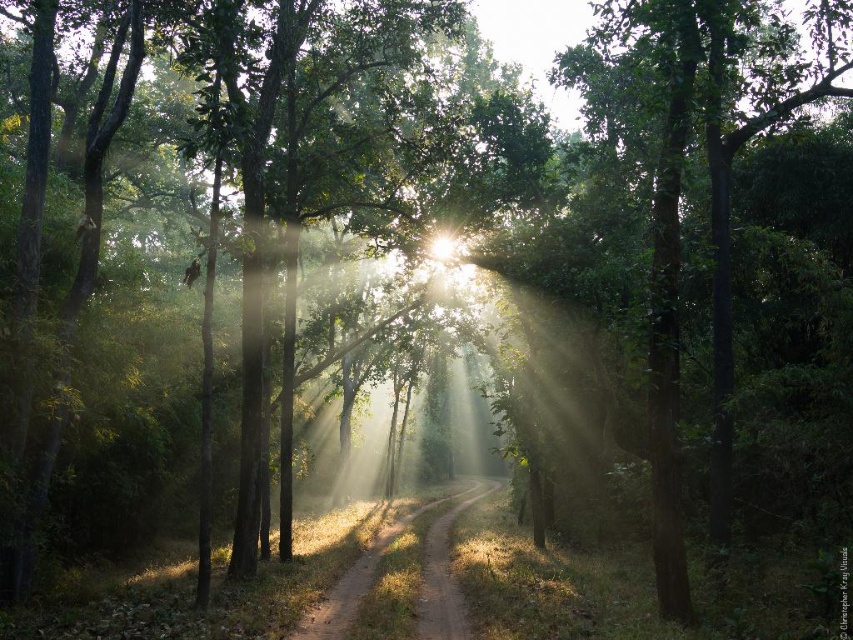
Is brown dirt track at center bigger than dirt/gravel path at center?

Yes.

Does brown dirt track at center appear on the right side of dirt/gravel path at center?

In fact, brown dirt track at center is to the left of dirt/gravel path at center.

Is point (428, 566) less distant than point (422, 624)?

No, (428, 566) is further to viewer.

Identify the location of brown dirt track at center. Image resolution: width=853 pixels, height=640 pixels. (419, 586).

Is brown dirt track at center closer to camera compared to bright white light at center?

Yes, brown dirt track at center is in front of bright white light at center.

Between point (440, 634) and point (440, 252), which one is positioned in front?

Point (440, 634) is more forward.

Which is in front, point (305, 625) or point (454, 243)?

Positioned in front is point (305, 625).

Locate an element on the screen. This screenshot has height=640, width=853. brown dirt track at center is located at coordinates (419, 586).

How distant is dirt/gravel path at center from bright white light at center?

dirt/gravel path at center is 8.00 meters away from bright white light at center.

Between point (445, 516) and point (451, 257), which one is positioned behind?

The point (445, 516) is behind.

Who is more distant from viewer, (440, 540) or (428, 252)?

Positioned behind is point (428, 252).

Image resolution: width=853 pixels, height=640 pixels. Find the location of `dirt/gravel path at center`. dirt/gravel path at center is located at coordinates (444, 580).